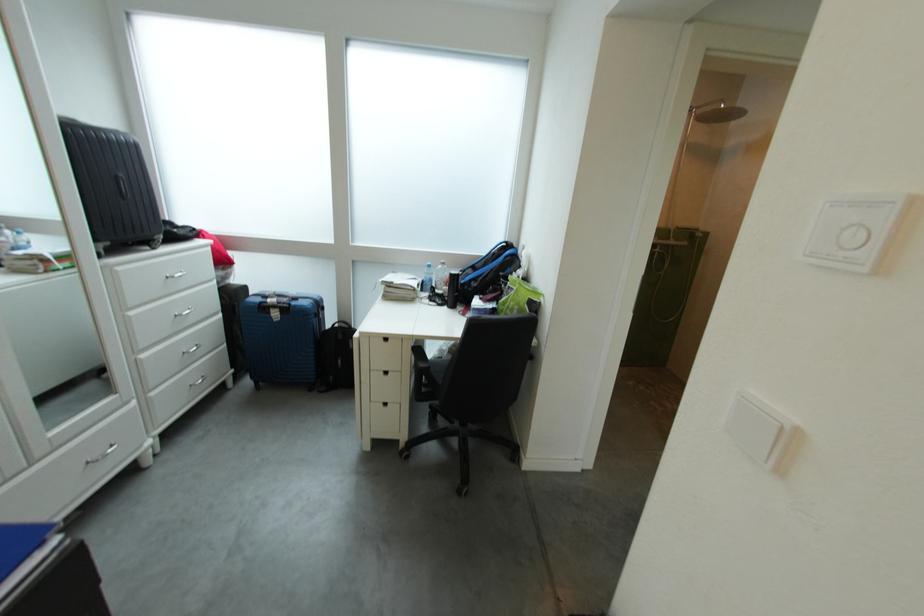
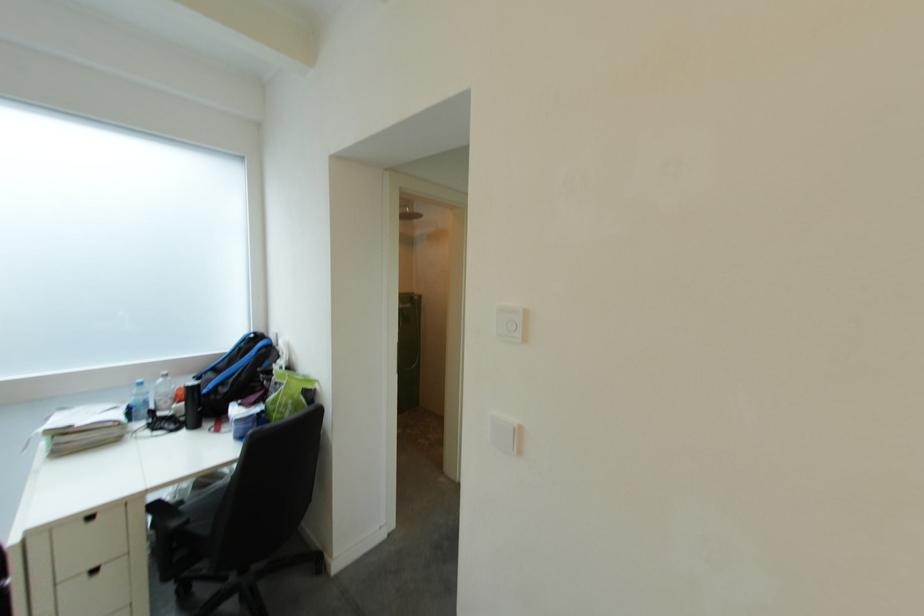
Find the pixel in the second image that matches the point at 458,302 in the first image.

(195, 422)